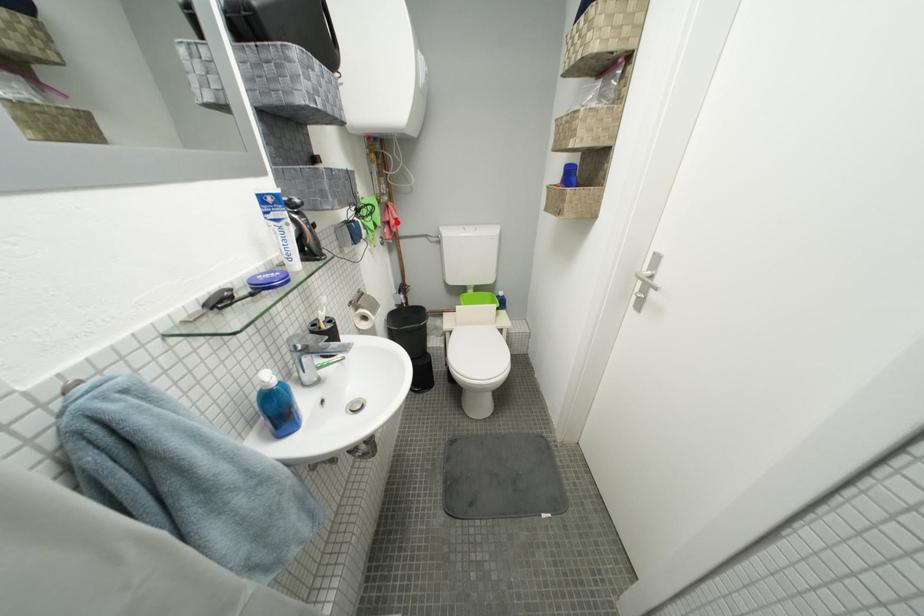
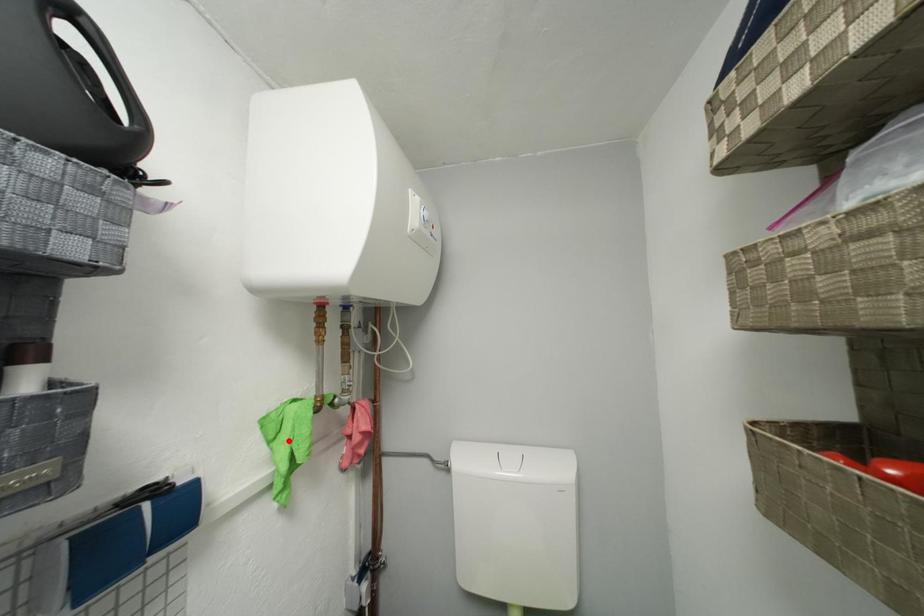
I am providing you with two images of the same scene from different viewpoints. A red point is marked on the first image and another point is marked on the second image. Is the marked point in image1 the same physical position as the marked point in image2?

No